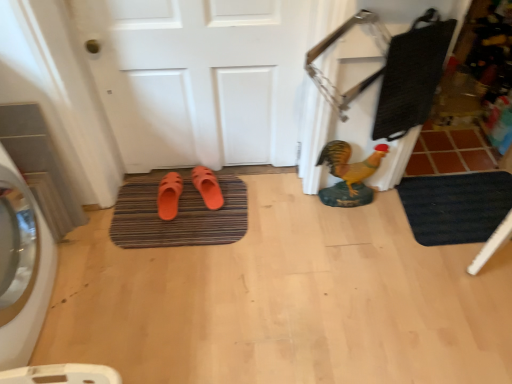
Locate an element on the screen. vacant space to the left of orange rubber slipper at center, marked as the 2th footwear in a left-to-right arrangement is located at coordinates (156, 193).